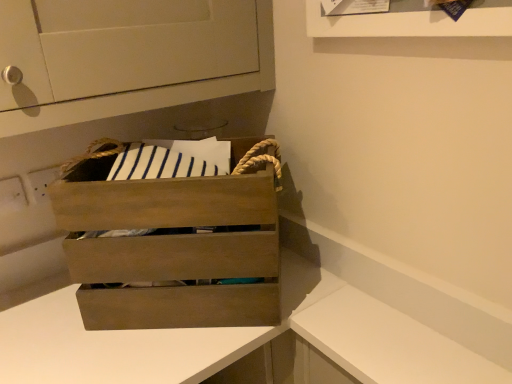
Question: From a real-world perspective, is wooden crate at center positioned above or below white matte counter at lower right, placed as the 2th counter when sorted from left to right?

Choices:
 (A) below
 (B) above

Answer: (B)

Question: Would you say wooden crate at center is to the left or to the right of white matte counter at lower right, placed as the first counter when sorted from right to left, in the picture?

Choices:
 (A) right
 (B) left

Answer: (B)

Question: Based on their relative distances, which object is nearer to the wooden crate at center, which is the 2th counter in right-to-left order?

Choices:
 (A) white matte counter at lower right, placed as the first counter when sorted from right to left
 (B) wooden crate at center

Answer: (A)

Question: Which is farther from the wooden crate at center, which is the 2th counter in right-to-left order?

Choices:
 (A) wooden crate at center
 (B) white matte counter at lower right, placed as the 2th counter when sorted from left to right

Answer: (A)